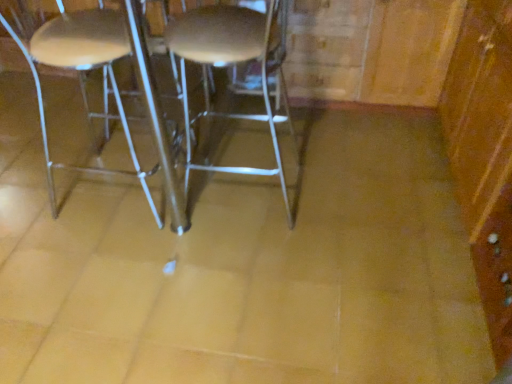
Question: In the image, is metallic silver stool at center positioned in front of or behind wooden dresser at right?

Choices:
 (A) behind
 (B) front

Answer: (A)

Question: Is metallic silver stool at center wider or thinner than wooden dresser at right?

Choices:
 (A) thin
 (B) wide

Answer: (A)

Question: Which of these objects is positioned closest to the wooden dresser at right?

Choices:
 (A) metallic silver stool at center
 (B) metallic silver stool at left

Answer: (A)

Question: Estimate the real-world distances between objects in this image. Which object is farther from the wooden dresser at right?

Choices:
 (A) metallic silver stool at center
 (B) metallic silver stool at left

Answer: (B)